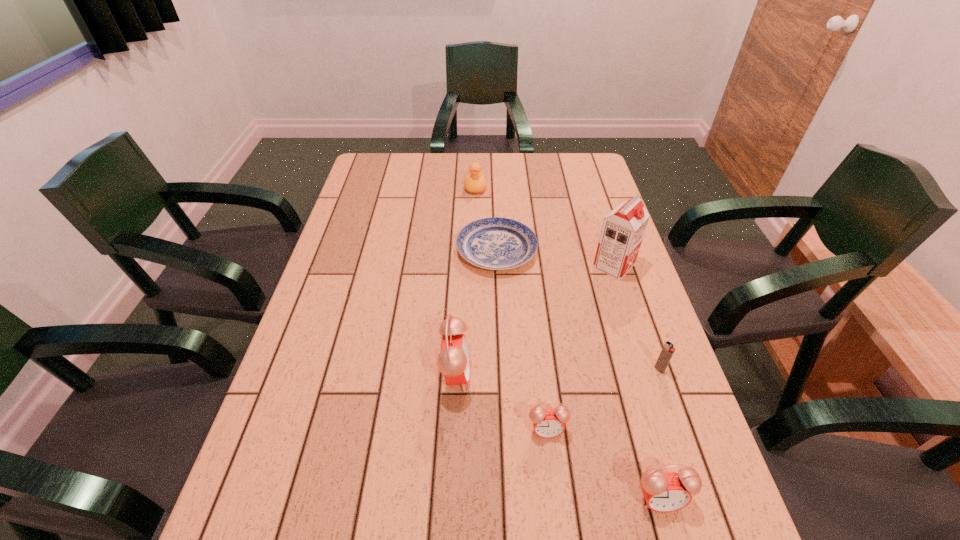
At what (x,y) coordinates should I click in order to perform the action: click on vacant area situated on the clock face of the farthest alarm clock. Please return your answer as a coordinate pair (x, y). Image resolution: width=960 pixels, height=540 pixels. Looking at the image, I should click on tap(644, 374).

Find the location of a particular element. free spot located on the clock face of the second nearest alarm clock is located at coordinates (556, 507).

Find the location of a particular element. vacant space located 0.140m on the face of the duck is located at coordinates (475, 220).

This screenshot has width=960, height=540. I want to click on vacant space situated on the back of the plate, so click(493, 185).

Where is `vacant area located 0.200m on the front of the soya milk`? vacant area located 0.200m on the front of the soya milk is located at coordinates (636, 338).

Where is `blank space located on the front of the igniter`? The height and width of the screenshot is (540, 960). blank space located on the front of the igniter is located at coordinates (689, 455).

Image resolution: width=960 pixels, height=540 pixels. Identify the location of object that is positioned at the far edge. (475, 182).

Where is `object present at the near edge`? object present at the near edge is located at coordinates (664, 492).

Identify the location of alarm clock located in the right edge section of the desktop. The height and width of the screenshot is (540, 960). (664, 492).

Identify the location of soya milk situated at the right edge. (623, 228).